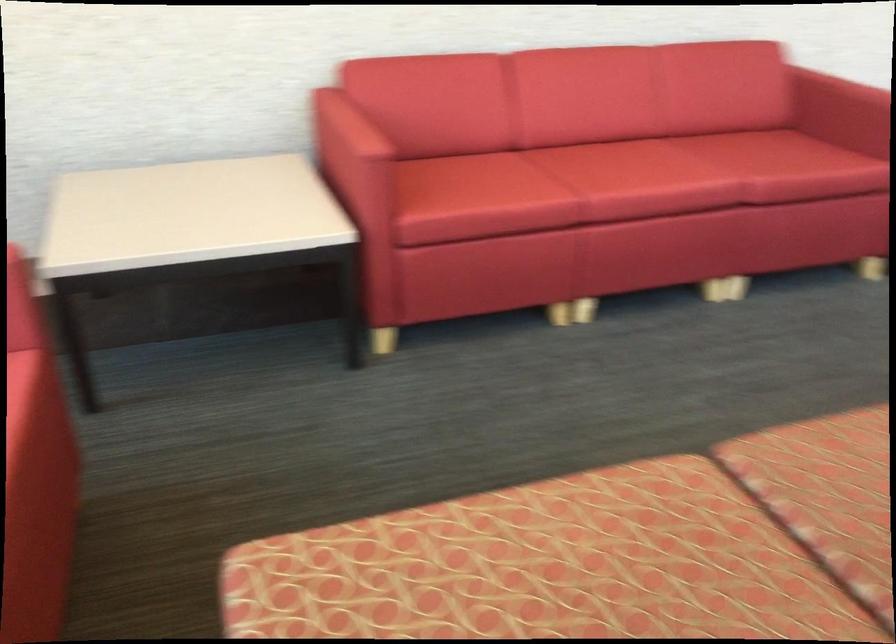
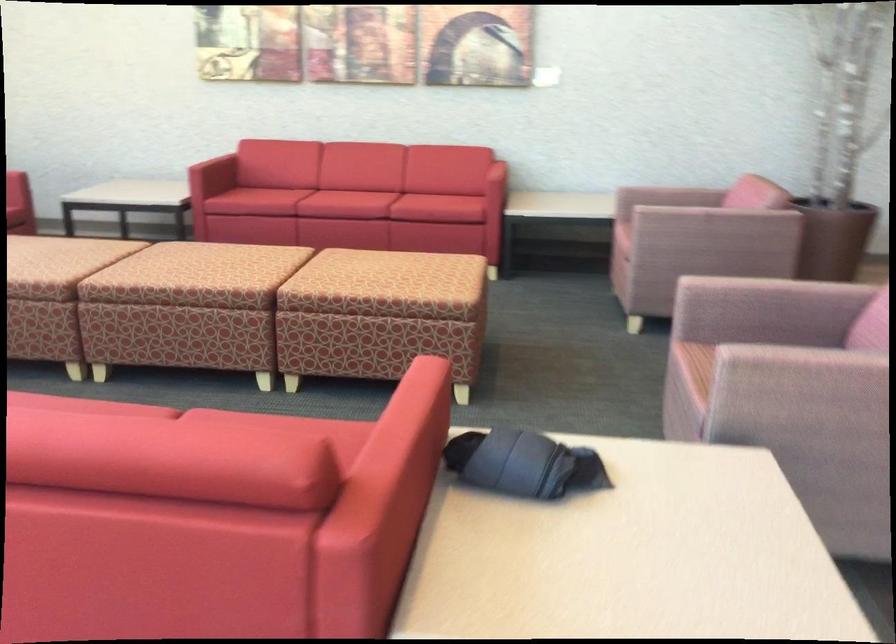
From the picture: Which direction would the cameraman need to move to produce the second image?

The cameraman walked toward right, backward.